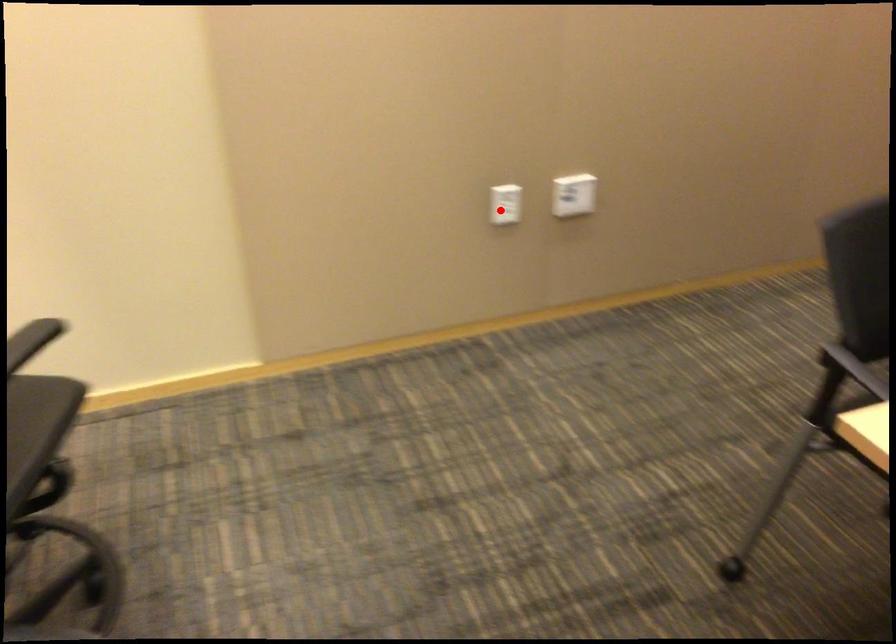
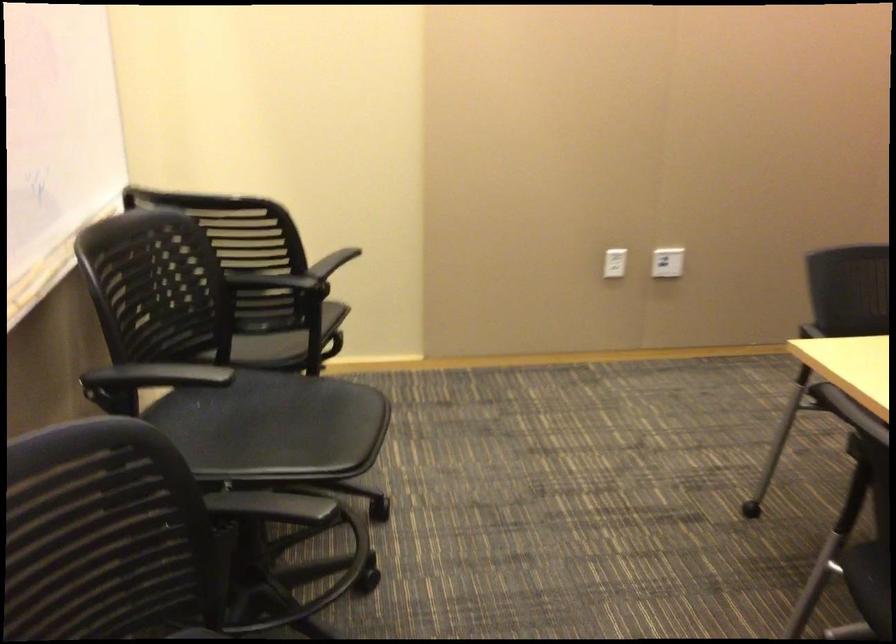
Question: I am providing you with two images of the same scene from different viewpoints. A red point is shown in image1. For the corresponding object point in image2, is it positioned nearer or farther from the camera?

Choices:
 (A) Nearer
 (B) Farther

Answer: (B)